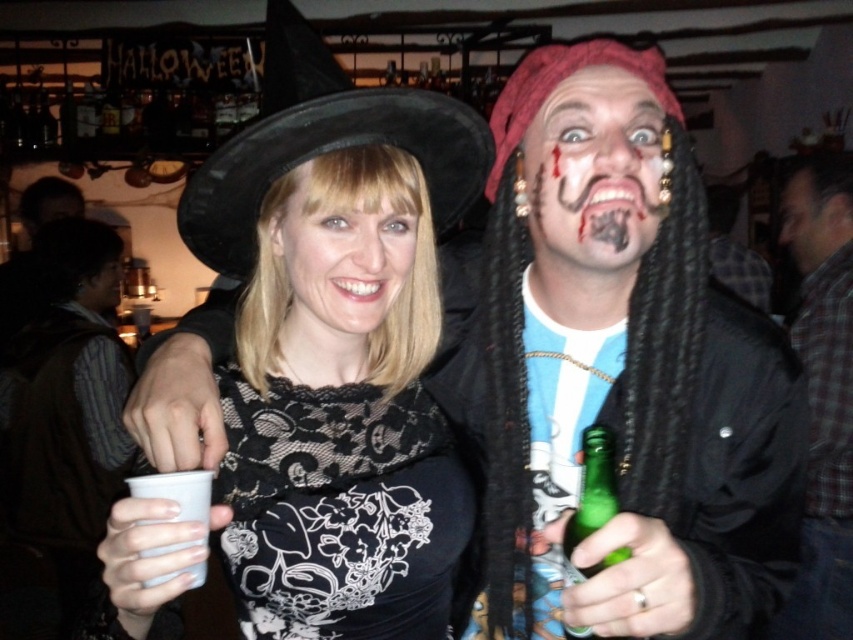
Question: Is black felt witch hat at upper left to the left of painted face at center from the viewer's perspective?

Choices:
 (A) yes
 (B) no

Answer: (A)

Question: Is the position of black lace dress at center more distant than that of matte black hat at upper left?

Choices:
 (A) no
 (B) yes

Answer: (A)

Question: Considering the relative positions of plaid shirt at right and green glass bottle at right in the image provided, where is plaid shirt at right located with respect to green glass bottle at right?

Choices:
 (A) below
 (B) above

Answer: (B)

Question: Among these points, which one is nearest to the camera?

Choices:
 (A) pos(802,237)
 (B) pos(299,529)
 (C) pos(809,557)

Answer: (B)

Question: Based on their relative distances, which object is farther from the white lace cup at lower left?

Choices:
 (A) green glass bottle at right
 (B) black felt witch hat at upper left
 (C) painted face at center
 (D) smooth skin face at upper right

Answer: (D)

Question: Among these objects, which one is nearest to the camera?

Choices:
 (A) green glass bottle at right
 (B) black lace dress at center
 (C) painted face at center

Answer: (B)